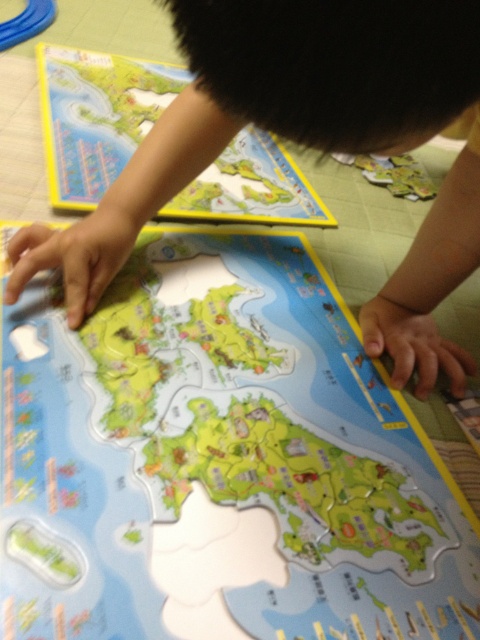
The scene shows a child assembling a puzzle on a tiled floor. The puzzle has bright green land and blue water areas. You notice a point labeled as point (271,108). What is the texture of the area at this point?

The point (271,108) indicates smooth skin at center.

What is located at the coordinates point (218,460)?

The light blue plastic map at center is located at point (218,460).